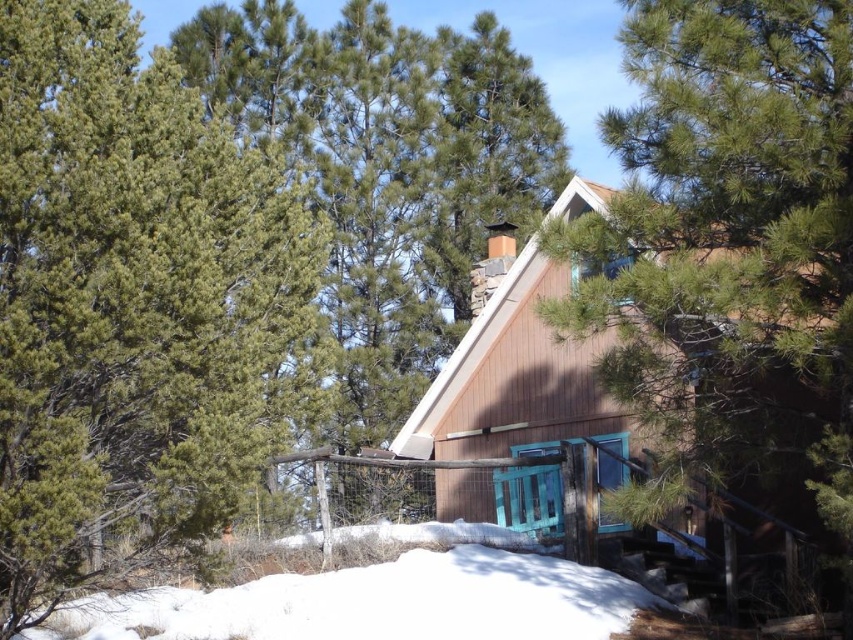
Does green pine tree at center have a smaller size compared to white powdery snow at lower center?

Yes, green pine tree at center is smaller than white powdery snow at lower center.

Does green pine tree at center appear over white powdery snow at lower center?

Yes.

Is point (630, 492) farther from viewer compared to point (630, 593)?

No, (630, 492) is closer to viewer.

I want to click on green pine tree at center, so click(729, 248).

Can you confirm if green pine tree at center is shorter than wooden cabin at center?

Yes, green pine tree at center is shorter than wooden cabin at center.

Is green pine tree at center behind wooden cabin at center?

No, it is in front of wooden cabin at center.

Image resolution: width=853 pixels, height=640 pixels. In order to click on green pine tree at center in this screenshot , I will do `click(729, 248)`.

Identify the location of green pine tree at center. [x=729, y=248].

Between green needle-like at upper left and wooden cabin at center, which one is positioned lower?

wooden cabin at center

In the scene shown: Does green needle-like at upper left have a larger size compared to wooden cabin at center?

Incorrect, green needle-like at upper left is not larger than wooden cabin at center.

Who is more forward, (x=79, y=420) or (x=508, y=506)?

Point (x=79, y=420) is in front.

Identify the location of green needle-like at upper left. (131, 305).